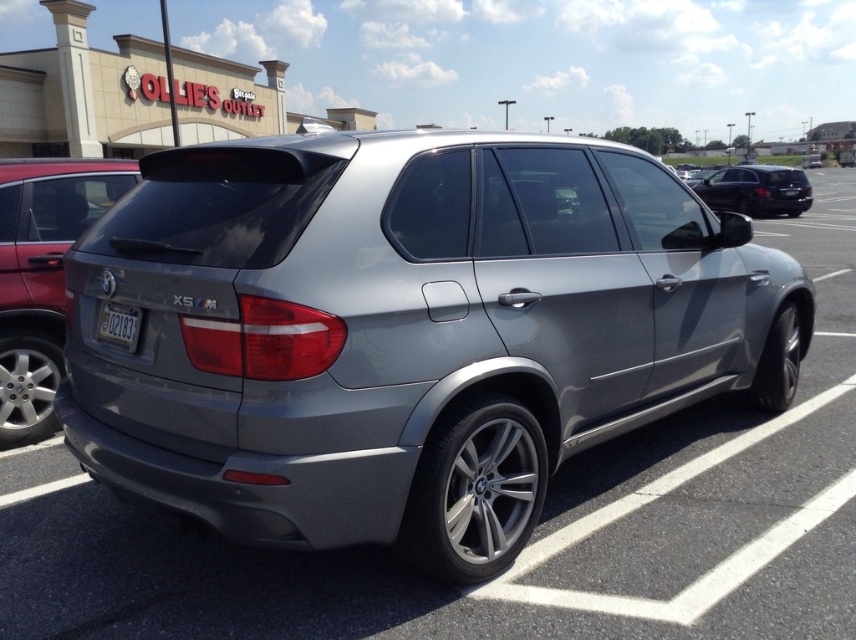
Question: Is satin silver minivan at rear smaller than white plastic license plate at rear?

Choices:
 (A) no
 (B) yes

Answer: (A)

Question: Can you confirm if satin metallic suv at center is positioned to the right of white plastic license plate at rear?

Choices:
 (A) no
 (B) yes

Answer: (B)

Question: Which point is farther to the camera?

Choices:
 (A) (571, 349)
 (B) (9, 244)
 (C) (102, 330)

Answer: (B)

Question: Which object is closer to the camera taking this photo?

Choices:
 (A) shiny black sedan at right
 (B) satin silver minivan at rear

Answer: (B)

Question: Which point appears closest to the camera in this image?

Choices:
 (A) (104, 307)
 (B) (708, 186)
 (C) (4, 412)

Answer: (A)

Question: Can you confirm if satin silver minivan at rear is bigger than white plastic license plate at rear?

Choices:
 (A) yes
 (B) no

Answer: (A)